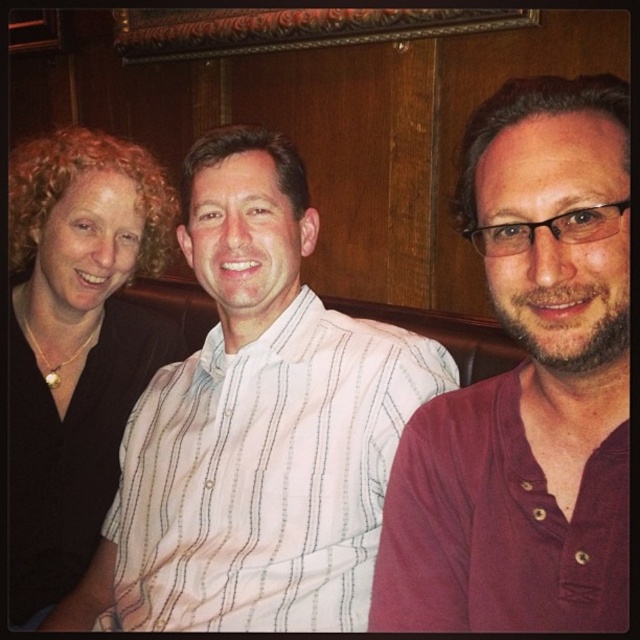
You are planning to buy a gift for the person wearing the maroon cotton shirt at right and the white striped shirt at center. If you want to choose a gift that fits their clothing sizes, which person should you buy a smaller size for?

The maroon cotton shirt at right is smaller than the white striped shirt at center, so you should buy a smaller size for the person wearing the maroon cotton shirt at right.

You are taking a photo of the maroon cotton shirt at right and the black matte shirt at left. Which shirt will appear larger in the photo?

The maroon cotton shirt at right will appear larger in the photo because it is closer to the viewer than the black matte shirt at left.

You are taking a photo of the three people sitting on the couch. The camera is positioned directly in front of them. To ensure the maroon cotton shirt at right is in focus, where should you adjust the focus point?

You should adjust the focus point to the coordinates provided in the Objects Description, specifically at point (x=528, y=387), to ensure the maroon cotton shirt at right is in focus.